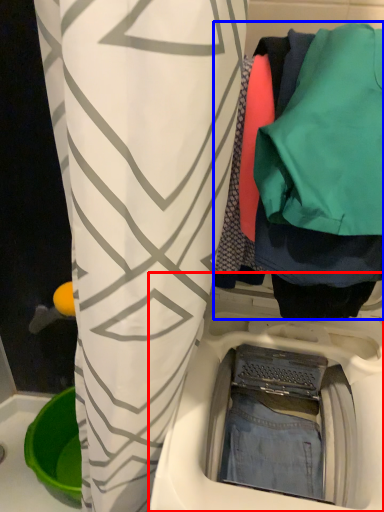
Question: Which of the following is the farthest to the observer, washing machine (highlighted by a red box) or closet (highlighted by a blue box)?

Choices:
 (A) washing machine
 (B) closet

Answer: (A)